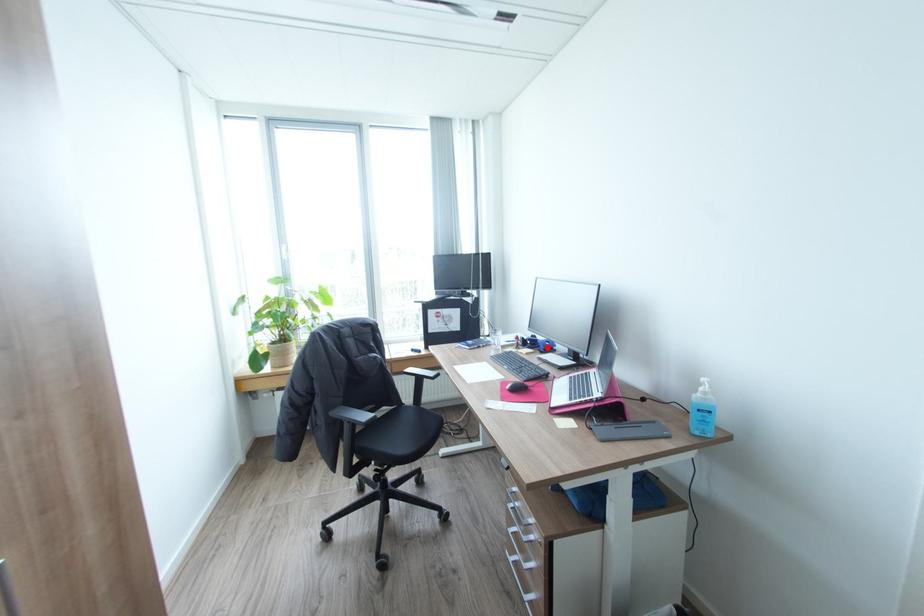
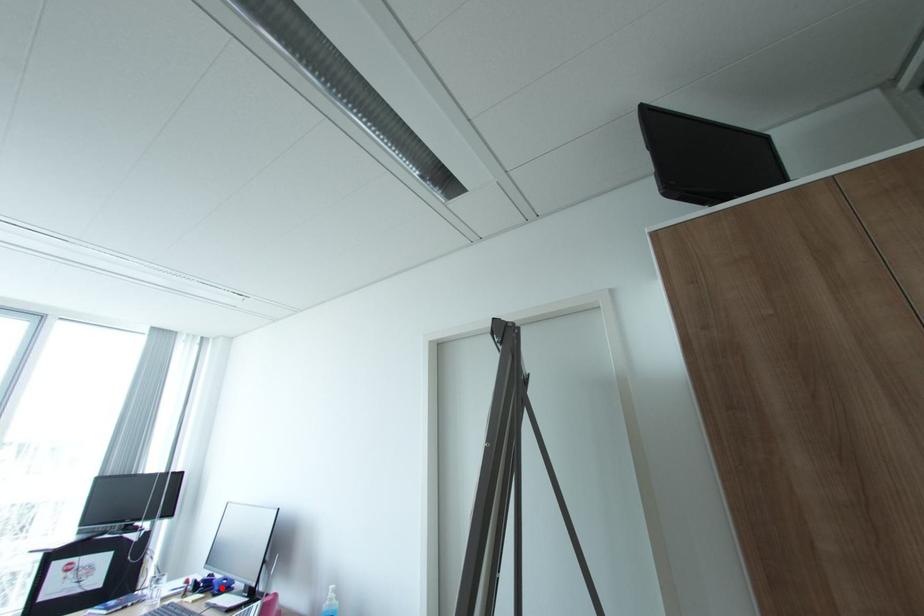
I am providing you with two images of the same scene from different viewpoints. A red point is marked on the first image and another point is marked on the second image. Does the point marked in image1 correspond to the same location as the one in image2?

Yes